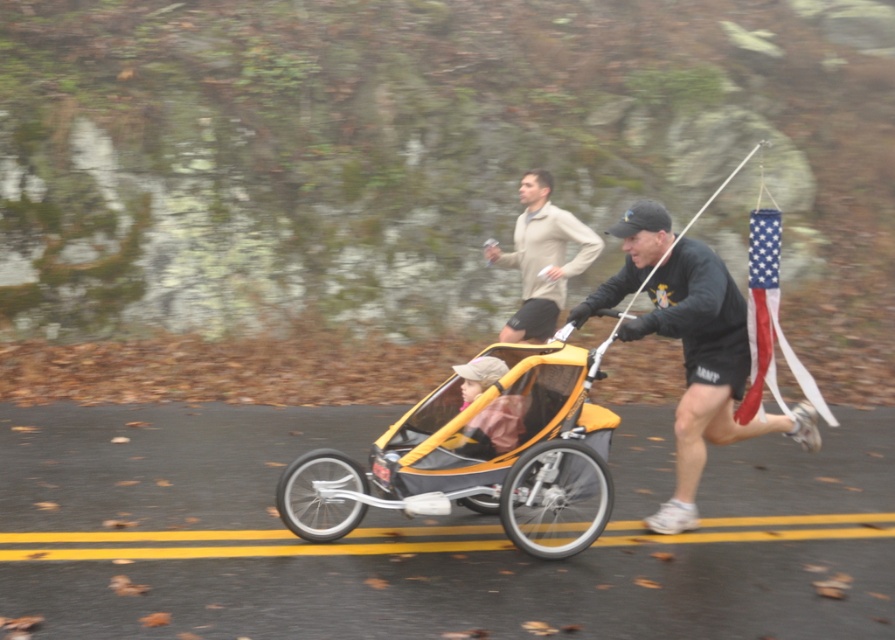
Is yellow solid lines at center thinner than light beige sweater at center?

In fact, yellow solid lines at center might be wider than light beige sweater at center.

Does point (222, 556) come in front of point (550, 284)?

Yes, point (222, 556) is in front of point (550, 284).

I want to click on yellow solid lines at center, so click(x=243, y=541).

Who is taller, black matte running shoe at lower right or light beige sweater at center?

Standing taller between the two is black matte running shoe at lower right.

Does black matte running shoe at lower right have a greater height compared to light beige sweater at center?

Yes.

The width and height of the screenshot is (895, 640). Describe the element at coordinates (705, 369) in the screenshot. I see `black matte running shoe at lower right` at that location.

The image size is (895, 640). I want to click on black matte running shoe at lower right, so click(x=705, y=369).

This screenshot has width=895, height=640. Describe the element at coordinates (243, 541) in the screenshot. I see `yellow solid lines at center` at that location.

Find the location of `yellow solid lines at center`. yellow solid lines at center is located at coordinates (243, 541).